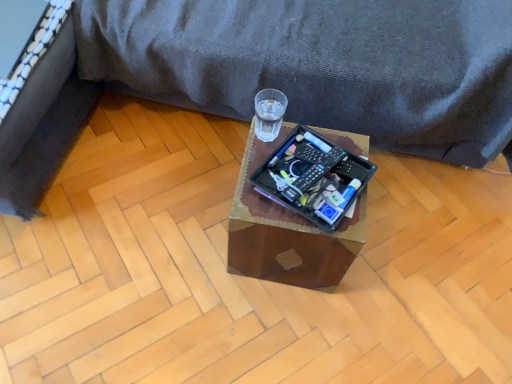
What are the coordinates of `vacant region in front of wooden tray at center` in the screenshot? It's located at (276, 331).